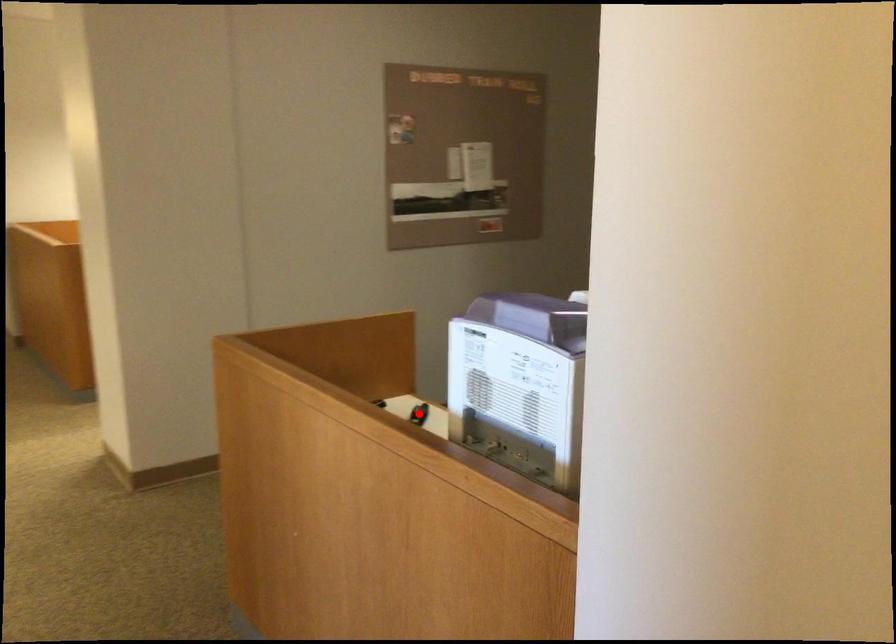
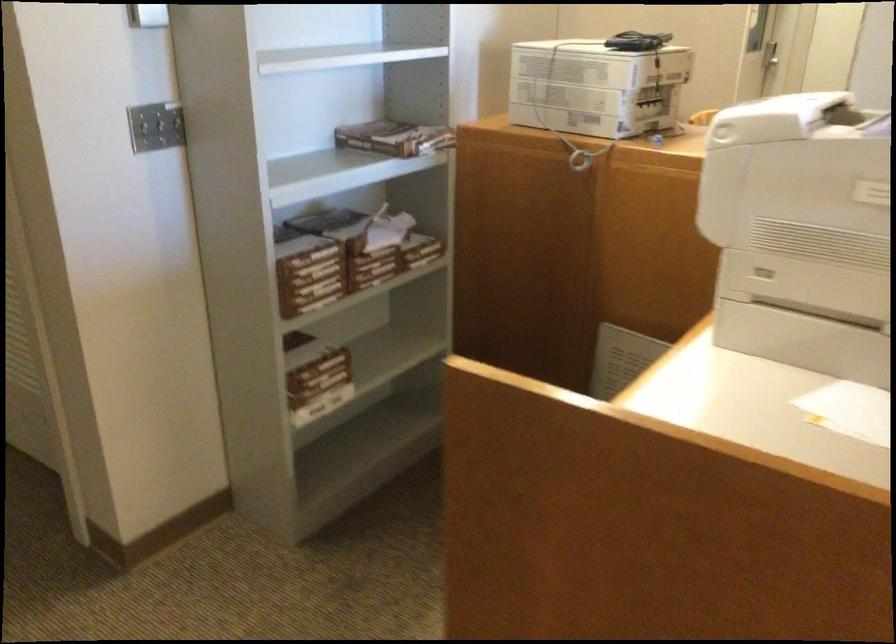
Question: I am providing you with two images of the same scene from different viewpoints. A red point is marked on the first image. Is the red point's position out of view in image 2?

Choices:
 (A) Yes
 (B) No

Answer: (A)